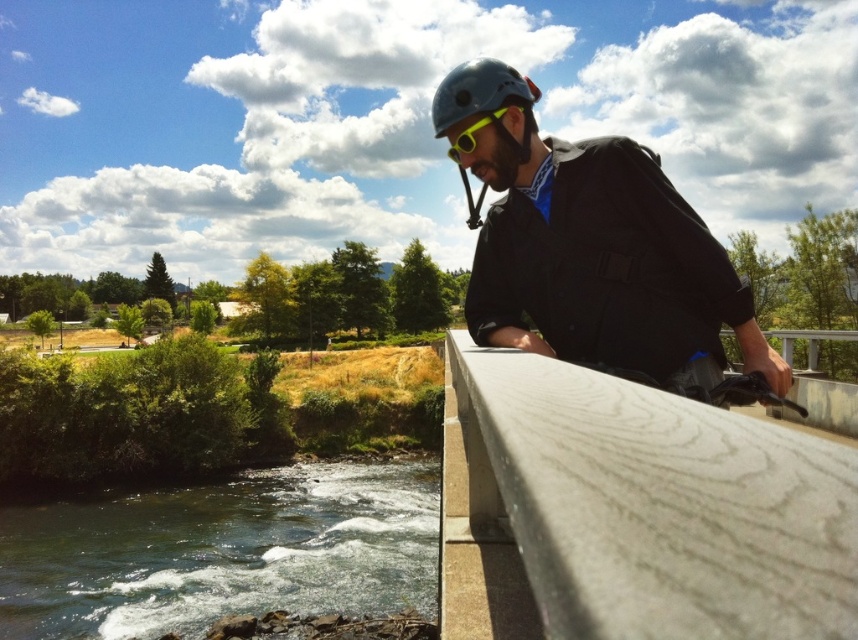
Question: Does smooth concrete ledge at upper right have a larger size compared to matte black helmet at upper right?

Choices:
 (A) yes
 (B) no

Answer: (B)

Question: Is smooth concrete ledge at upper right to the left of greenish-gray water at lower left from the viewer's perspective?

Choices:
 (A) yes
 (B) no

Answer: (B)

Question: Among these points, which one is farthest from the camera?

Choices:
 (A) (466, 132)
 (B) (844, 476)
 (C) (361, 544)

Answer: (C)

Question: Among these objects, which one is farthest from the camera?

Choices:
 (A) yellow matte/glossy goggles at center
 (B) matte black helmet at upper right
 (C) matte blue helmet at upper center

Answer: (A)

Question: Which point is closer to the camera taking this photo?

Choices:
 (A) (502, 380)
 (B) (784, 380)
 (C) (467, 141)

Answer: (A)

Question: Is smooth concrete ledge at upper right closer to the viewer compared to yellow matte/glossy goggles at center?

Choices:
 (A) yes
 (B) no

Answer: (A)